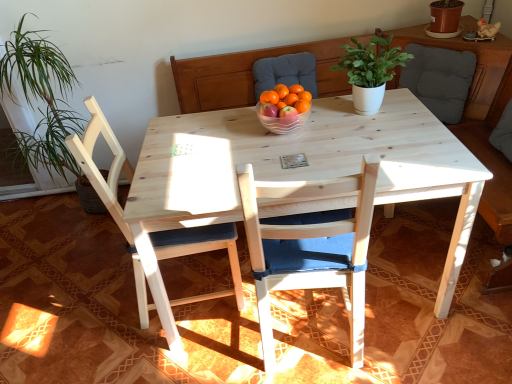
You are a GUI agent. You are given a task and a screenshot of the screen. Output one action in this format:
    pyautogui.click(x=<x>, y=<y>)
    Task: Click on the vacant area on top of dark gray fabric cushion at upper right (from a real-world perspective)
    The image size is (512, 384).
    Given the screenshot: What is the action you would take?
    pyautogui.click(x=423, y=39)